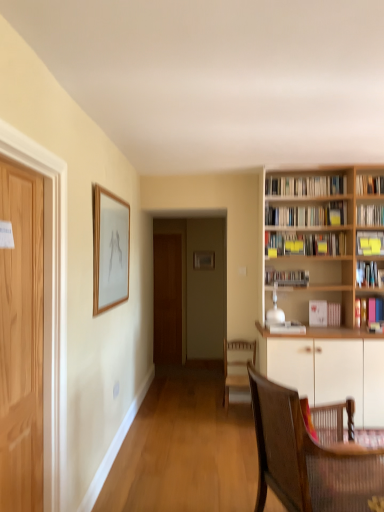
The image size is (384, 512). In order to click on wooden bookcase at right in this screenshot , I will do `click(322, 239)`.

Describe the element at coordinates (324, 313) in the screenshot. I see `white paper book at right, arranged as the second book when ordered from the bottom` at that location.

This screenshot has height=512, width=384. What do you see at coordinates (370, 243) in the screenshot? I see `yellow sticky notes at upper right, acting as the 5th book starting from the top` at bounding box center [370, 243].

I want to click on white glossy book at lower center, the first book in the bottom-to-top sequence, so click(286, 327).

Image resolution: width=384 pixels, height=512 pixels. I want to click on yellow paper-covered book at center, marked as the 6th book in a bottom-to-top arrangement, so click(306, 244).

Measure the distance between point (x=346, y=210) and camera.

3.86 meters.

I want to click on wooden bookcase at right, so click(322, 239).

Considering the relative positions of light brown wooden door at left, which is counted as the second door, starting from the right, and white paper book at right, arranged as the second book when ordered from the bottom, in the image provided, is light brown wooden door at left, which is counted as the second door, starting from the right, in front of white paper book at right, arranged as the second book when ordered from the bottom,?

Yes, it is.

Who is smaller, light brown wooden door at left, which appears as the first door when viewed from the left, or white paper book at right, arranged as the second book when ordered from the bottom?

white paper book at right, arranged as the second book when ordered from the bottom.

Is light brown wooden door at left, which appears as the first door when viewed from the left, facing away from white paper book at right, which is the 8th book from top to bottom?

No, light brown wooden door at left, which appears as the first door when viewed from the left,'s orientation is not away from white paper book at right, which is the 8th book from top to bottom.

Considering the positions of objects brown wooden door at center, the first door viewed from the right, and hardcover books at upper right, which appears as the eighth book when ordered from the bottom, in the image provided, who is more to the left, brown wooden door at center, the first door viewed from the right, or hardcover books at upper right, which appears as the eighth book when ordered from the bottom,?

From the viewer's perspective, brown wooden door at center, the first door viewed from the right, appears more on the left side.

Is brown wooden door at center, the second door when ordered from front to back, smaller than hardcover books at upper right, which is the 2th book in top-to-bottom order?

Actually, brown wooden door at center, the second door when ordered from front to back, might be larger than hardcover books at upper right, which is the 2th book in top-to-bottom order.

From the image's perspective, who appears lower, brown wooden door at center, the 2th door viewed from the left, or hardcover books at upper right, which is the 2th book in top-to-bottom order?

From the image's view, brown wooden door at center, the 2th door viewed from the left, is below.

How different are the orientations of wooden bookcase at right and yellow sticky notes at upper right, positioned as the fifth book in bottom-to-top order, in degrees?

The angular difference between wooden bookcase at right and yellow sticky notes at upper right, positioned as the fifth book in bottom-to-top order, is 8.35 degrees.

From the image's perspective, which one is positioned lower, wooden bookcase at right or yellow sticky notes at upper right, positioned as the fifth book in bottom-to-top order?

wooden bookcase at right is shown below in the image.

Based on the photo, does wooden bookcase at right have a larger size compared to yellow sticky notes at upper right, positioned as the fifth book in bottom-to-top order?

Indeed, wooden bookcase at right has a larger size compared to yellow sticky notes at upper right, positioned as the fifth book in bottom-to-top order.

From a real-world perspective, is wooden bookcase at right on yellow sticky notes at upper right, positioned as the fifth book in bottom-to-top order?

No, from a real-world perspective, wooden bookcase at right is not above yellow sticky notes at upper right, positioned as the fifth book in bottom-to-top order.

From their relative heights in the image, would you say hardcover books at upper right, which is the 2th book in top-to-bottom order, is taller or shorter than pink matte book at right, which is counted as the 3th book, starting from the bottom?

In the image, hardcover books at upper right, which is the 2th book in top-to-bottom order, appears to be shorter than pink matte book at right, which is counted as the 3th book, starting from the bottom.

Choose the correct answer: Is hardcover books at upper right, which is the 2th book in top-to-bottom order, inside pink matte book at right, which is counted as the 3th book, starting from the bottom, or outside it?

hardcover books at upper right, which is the 2th book in top-to-bottom order, is spatially situated outside pink matte book at right, which is counted as the 3th book, starting from the bottom.

Can you confirm if hardcover books at upper right, which is the 2th book in top-to-bottom order, is positioned to the right of pink matte book at right, positioned as the 7th book in top-to-bottom order?

Incorrect, hardcover books at upper right, which is the 2th book in top-to-bottom order, is not on the right side of pink matte book at right, positioned as the 7th book in top-to-bottom order.

From the image's perspective, is hardcover books at upper right, which appears as the eighth book when ordered from the bottom, located beneath pink matte book at right, which is counted as the 3th book, starting from the bottom?

Actually, hardcover books at upper right, which appears as the eighth book when ordered from the bottom, appears above pink matte book at right, which is counted as the 3th book, starting from the bottom, in the image.

From a real-world perspective, which is physically below, matte wooden picture frame at upper left or wooden bookcase at right?

matte wooden picture frame at upper left.

Considering their positions, is matte wooden picture frame at upper left located in front of or behind wooden bookcase at right?

matte wooden picture frame at upper left is in front of wooden bookcase at right.

Could you tell me if matte wooden picture frame at upper left is turned towards wooden bookcase at right?

Yes, matte wooden picture frame at upper left is facing wooden bookcase at right.

Is matte wooden picture frame at upper left outside of wooden bookcase at right?

Absolutely, matte wooden picture frame at upper left is external to wooden bookcase at right.

How different are the orientations of white paper bookshelf at right, the 7th book when ordered from bottom to top, and white matte cabinet at right in degrees?

The angle between the facing direction of white paper bookshelf at right, the 7th book when ordered from bottom to top, and the facing direction of white matte cabinet at right is 0.321 degrees.

Is white paper bookshelf at right, the 7th book when ordered from bottom to top, bigger or smaller than white matte cabinet at right?

In the image, white paper bookshelf at right, the 7th book when ordered from bottom to top, appears to be smaller than white matte cabinet at right.

Locate an element on the screen. The width and height of the screenshot is (384, 512). book that is the 4th object to the right of the white matte cabinet at right, starting at the anchor is located at coordinates (370, 215).

From the image's perspective, is white paper bookshelf at right, the 7th book when ordered from bottom to top, located above or below white matte cabinet at right?

Based on their image positions, white paper bookshelf at right, the 7th book when ordered from bottom to top, is located above white matte cabinet at right.

From the image's perspective, starting from the yellow sticky notes at upper right, positioned as the fifth book in bottom-to-top order, which book is the 1st one above? Please provide its 2D coordinates.

[(306, 244)]

In terms of width, does yellow sticky notes at upper right, acting as the 5th book starting from the top, look wider or thinner when compared to yellow paper-covered book at center, placed as the 4th book when sorted from top to bottom?

yellow sticky notes at upper right, acting as the 5th book starting from the top, is thinner than yellow paper-covered book at center, placed as the 4th book when sorted from top to bottom.

Who is smaller, yellow sticky notes at upper right, acting as the 5th book starting from the top, or yellow paper-covered book at center, marked as the 6th book in a bottom-to-top arrangement?

Smaller between the two is yellow sticky notes at upper right, acting as the 5th book starting from the top.

Who is more distant, yellow sticky notes at upper right, acting as the 5th book starting from the top, or yellow paper-covered book at center, placed as the 4th book when sorted from top to bottom?

yellow paper-covered book at center, placed as the 4th book when sorted from top to bottom, is more distant.

Where is `book that is the 2nd one when counting downward from the light brown wooden door at left, which is counted as the second door, starting from the right (from the image's perspective)`? This screenshot has width=384, height=512. book that is the 2nd one when counting downward from the light brown wooden door at left, which is counted as the second door, starting from the right (from the image's perspective) is located at coordinates (324, 313).

The width and height of the screenshot is (384, 512). Identify the location of book that is the 3rd object to the right of the brown wooden door at center, the first door viewed from the right, starting at the anchor. (305, 215).

From the image, which object appears to be farther from yellow sticky notes at upper right, positioned as the fifth book in bottom-to-top order, white glossy book at lower center, the first book in the bottom-to-top sequence, or brown woven chair at lower right, the 1th chair viewed from the front?

brown woven chair at lower right, the 1th chair viewed from the front, is positioned further to the anchor yellow sticky notes at upper right, positioned as the fifth book in bottom-to-top order.

Which object lies nearer to the anchor point white matte cabinet at right, yellow paper-covered book at center, marked as the 6th book in a bottom-to-top arrangement, or brown woven chair at lower right, the 2th chair from the back?

yellow paper-covered book at center, marked as the 6th book in a bottom-to-top arrangement.

Estimate the real-world distances between objects in this image. Which object is closer to brown wooden door at center, which is the first door from back to front, white glossy book at lower center, the first book in the bottom-to-top sequence, or matte wooden picture frame at upper left?

white glossy book at lower center, the first book in the bottom-to-top sequence.

When comparing their distances from pink matte book at right, which is counted as the 3th book, starting from the bottom, does white paper book at right, arranged as the second book when ordered from the bottom, or wooden bookcase at right seem closer?

Based on the image, white paper book at right, arranged as the second book when ordered from the bottom, appears to be nearer to pink matte book at right, which is counted as the 3th book, starting from the bottom.

Looking at the image, which one is located closer to yellow sticky notes at upper right, positioned as the fifth book in bottom-to-top order, yellow paper-covered book at center, placed as the 4th book when sorted from top to bottom, or hardcover book at upper right, which is the 1th book from top to bottom?

Among the two, yellow paper-covered book at center, placed as the 4th book when sorted from top to bottom, is located nearer to yellow sticky notes at upper right, positioned as the fifth book in bottom-to-top order.

Looking at the image, which one is located closer to matte black bookshelf at center, the 4th book in the bottom-to-top sequence, pink matte book at right, positioned as the 7th book in top-to-bottom order, or white matte cabinet at right?

pink matte book at right, positioned as the 7th book in top-to-bottom order, is positioned closer to the anchor matte black bookshelf at center, the 4th book in the bottom-to-top sequence.

From the image, which object appears to be farther from white paper bookshelf at right, acting as the third book starting from the top, matte wooden picture frame at upper left or yellow sticky notes at upper right, acting as the 5th book starting from the top?

matte wooden picture frame at upper left.

When comparing their distances from white matte cabinet at right, does light brown wooden door at left, which ranks as the first door in front-to-back order, or hardcover books at upper right, which appears as the eighth book when ordered from the bottom, seem closer?

hardcover books at upper right, which appears as the eighth book when ordered from the bottom, is positioned closer to the anchor white matte cabinet at right.

What are the coordinates of `cabinetry between light brown wooden door at left, which is counted as the second door, starting from the right, and matte black bookshelf at center, which is the 6th book from top to bottom, along the z-axis` in the screenshot? It's located at click(329, 368).

Find the location of a particular element. bookcase between light brown wooden door at left, which appears as the first door when viewed from the left, and pink matte book at right, which is counted as the 3th book, starting from the bottom, in the front-back direction is located at coordinates (322, 239).

Identify the location of cabinetry between brown woven chair at lower right, the 2th chair from the back, and wooden chair at center, which is counted as the 1th chair, starting from the back, from front to back. (329, 368).

This screenshot has width=384, height=512. What are the coordinates of `chair between light brown wooden door at left, marked as the 2th door in a back-to-front arrangement, and wooden bookcase at right in the front-back direction` in the screenshot? It's located at (311, 455).